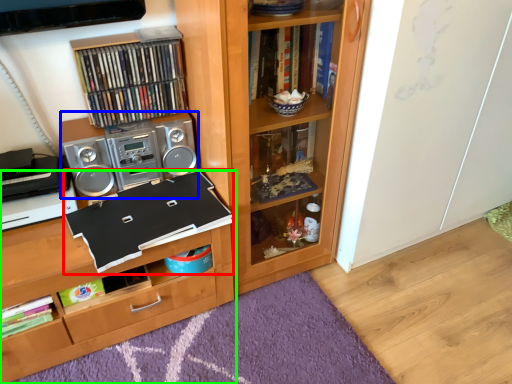
Question: Which object is the closest to the book (highlighted by a red box)? Choose among these: stereo (highlighted by a blue box) or shelf (highlighted by a green box).

Choices:
 (A) stereo
 (B) shelf

Answer: (B)